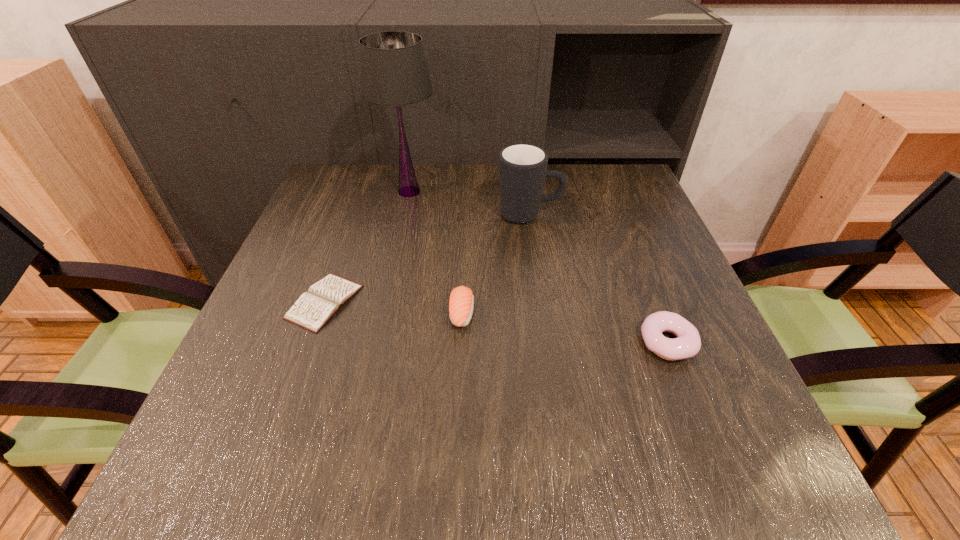
This screenshot has height=540, width=960. In order to click on vacant space located 0.190m on the left of the sushi in this screenshot , I will do `click(355, 313)`.

The height and width of the screenshot is (540, 960). I want to click on vacant space located 0.070m on the back of the rightmost object, so click(x=650, y=296).

Identify the location of blank area located on the front of the shortest object. The height and width of the screenshot is (540, 960). (288, 404).

What are the coordinates of `lampshade located in the far edge section of the desktop` in the screenshot? It's located at (393, 68).

This screenshot has width=960, height=540. I want to click on mug present at the far edge, so click(x=522, y=167).

Locate an element on the screen. The height and width of the screenshot is (540, 960). object situated at the left edge is located at coordinates (314, 308).

Locate an element on the screen. This screenshot has width=960, height=540. object present at the right edge is located at coordinates (687, 344).

The width and height of the screenshot is (960, 540). What are the coordinates of `blank area at the far edge` in the screenshot? It's located at (449, 167).

The width and height of the screenshot is (960, 540). What are the coordinates of `free space at the near edge of the desktop` in the screenshot? It's located at (290, 480).

Locate an element on the screen. free space at the left edge of the desktop is located at coordinates (311, 254).